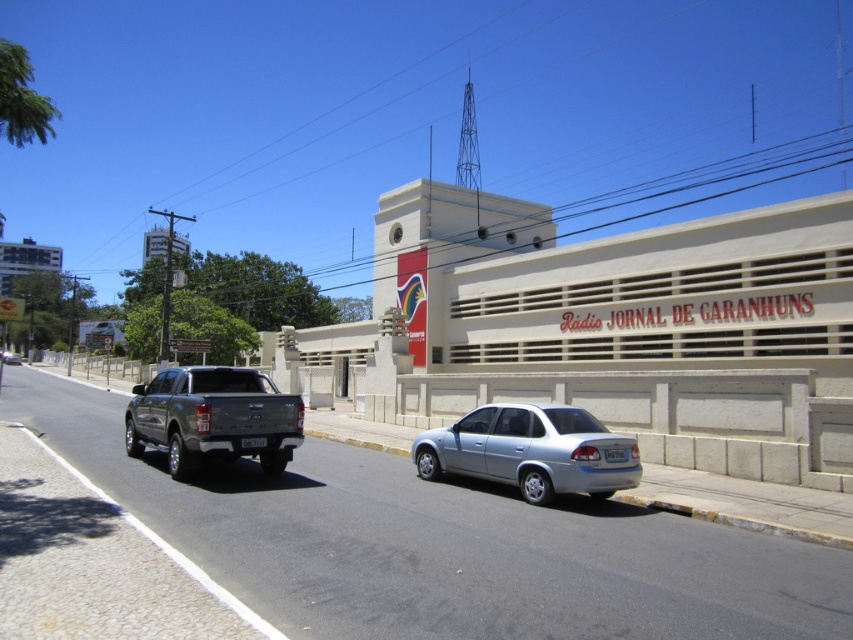
Does white plastic license plate at center appear under black plastic license plate at rear?

Indeed, white plastic license plate at center is positioned under black plastic license plate at rear.

Based on the photo, who is positioned more to the left, white plastic license plate at center or black plastic license plate at rear?

black plastic license plate at rear

This screenshot has height=640, width=853. What are the coordinates of `white plastic license plate at center` in the screenshot? It's located at (614, 454).

Is point (155, 417) farther from viewer compared to point (10, 356)?

No, (155, 417) is closer to viewer.

Between point (173, 454) and point (16, 358), which one is positioned behind?

The point (16, 358) is more distant.

Who is more forward, (204,376) or (13,355)?

Point (204,376) is more forward.

Find the location of `metallic gray pickup truck at left`. metallic gray pickup truck at left is located at coordinates (212, 417).

Who is more forward, (514,412) or (16,358)?

Point (514,412) is in front.

Who is positioned more to the right, satin silver sedan at lower center or silver metallic sedan at center?

Positioned to the right is satin silver sedan at lower center.

Identify the location of satin silver sedan at lower center. The height and width of the screenshot is (640, 853). (529, 451).